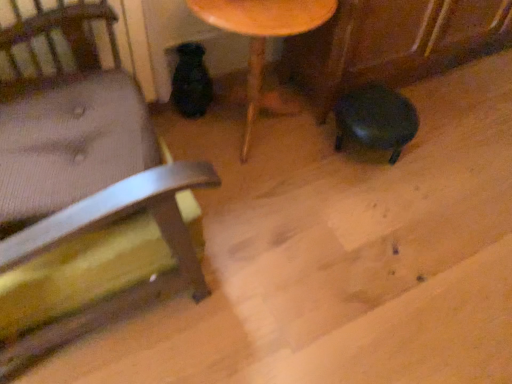
Question: In the image, is matte black stool at lower right on the left side or the right side of wooden table at center?

Choices:
 (A) right
 (B) left

Answer: (A)

Question: Considering the positions of matte black stool at lower right and wooden table at center in the image, is matte black stool at lower right bigger or smaller than wooden table at center?

Choices:
 (A) small
 (B) big

Answer: (A)

Question: Estimate the real-world distances between objects in this image. Which object is farther from the wooden table at center?

Choices:
 (A) matte black stool at lower right
 (B) wooden chair at left

Answer: (B)

Question: Based on their relative distances, which object is farther from the wooden chair at left?

Choices:
 (A) matte black stool at lower right
 (B) wooden table at center

Answer: (A)